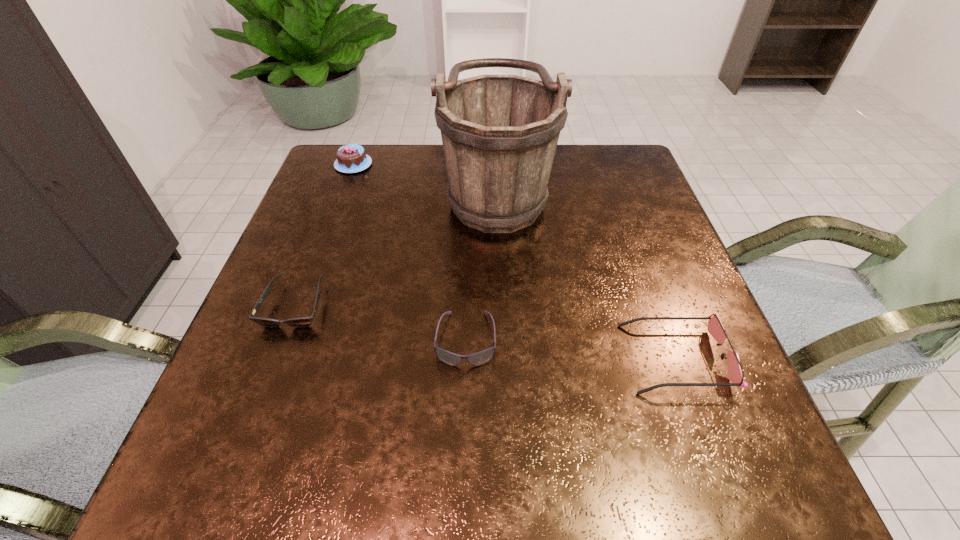
At what (x,y) coordinates should I click in order to perform the action: click on the tallest object. Please return your answer as a coordinate pair (x, y). The width and height of the screenshot is (960, 540). Looking at the image, I should click on pyautogui.click(x=499, y=133).

The height and width of the screenshot is (540, 960). Find the location of `chocolate cake`. chocolate cake is located at coordinates (352, 158).

I want to click on the rightmost sunglasses, so click(x=735, y=372).

I want to click on the rightmost object, so click(x=735, y=372).

The height and width of the screenshot is (540, 960). What are the coordinates of `the second sunglasses from left to right` in the screenshot? It's located at (476, 359).

Image resolution: width=960 pixels, height=540 pixels. Find the location of `the leftmost sunglasses`. the leftmost sunglasses is located at coordinates (302, 321).

Where is `vacant space located 0.090m on the handle side of the tallest object`? This screenshot has width=960, height=540. vacant space located 0.090m on the handle side of the tallest object is located at coordinates (406, 189).

At what (x,y) coordinates should I click in order to perform the action: click on vacant point located on the handle side of the tallest object. Please return your answer as a coordinate pair (x, y). The height and width of the screenshot is (540, 960). Looking at the image, I should click on (398, 189).

This screenshot has height=540, width=960. In order to click on free location located 0.290m on the handle side of the tallest object in this screenshot , I will do `click(325, 189)`.

The height and width of the screenshot is (540, 960). Identify the location of free spot located 0.230m on the front of the chocolate cake. (328, 232).